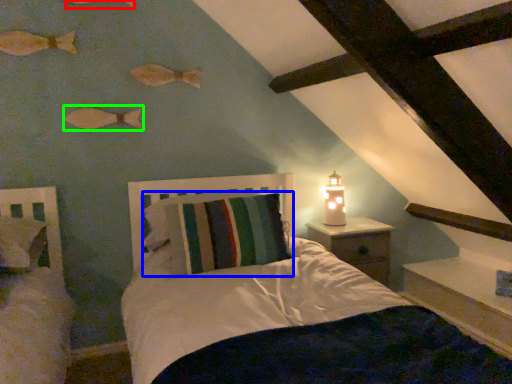
Question: Which is farther away from fish (highlighted by a red box)? pillow (highlighted by a blue box) or fish (highlighted by a green box)?

Choices:
 (A) pillow
 (B) fish

Answer: (A)